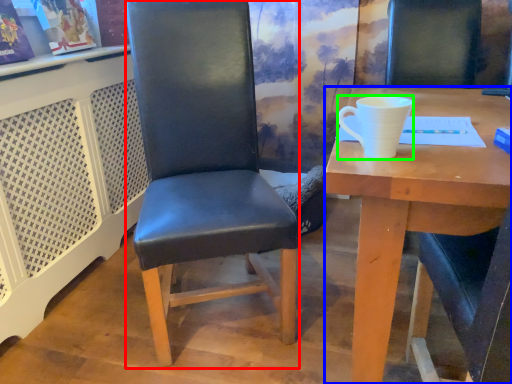
Question: Which object is positioned closest to chair (highlighted by a red box)? Select from desk (highlighted by a blue box) and coffee cup (highlighted by a green box).

Choices:
 (A) desk
 (B) coffee cup

Answer: (A)